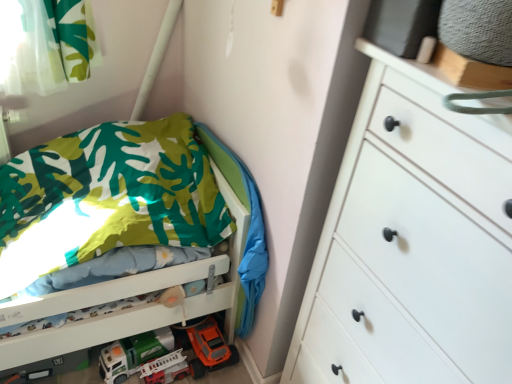
Question: Is green fabric blanket at lower left thinner than matte white plastic fire truck at lower left, placed as the 2th toy car when sorted from left to right?

Choices:
 (A) no
 (B) yes

Answer: (B)

Question: Is green fabric blanket at lower left behind matte white plastic fire truck at lower left, marked as the first toy car in a right-to-left arrangement?

Choices:
 (A) no
 (B) yes

Answer: (A)

Question: Can you confirm if green fabric blanket at lower left is shorter than matte white plastic fire truck at lower left, placed as the 2th toy car when sorted from left to right?

Choices:
 (A) yes
 (B) no

Answer: (B)

Question: Is green fabric blanket at lower left touching matte white plastic fire truck at lower left, placed as the 2th toy car when sorted from left to right?

Choices:
 (A) yes
 (B) no

Answer: (B)

Question: Considering the relative sizes of green fabric blanket at lower left and matte white plastic fire truck at lower left, marked as the first toy car in a right-to-left arrangement, in the image provided, is green fabric blanket at lower left taller than matte white plastic fire truck at lower left, marked as the first toy car in a right-to-left arrangement,?

Choices:
 (A) yes
 (B) no

Answer: (A)

Question: From their relative heights in the image, would you say printed fabric bed at left is taller or shorter than matte white plastic fire truck at lower left, placed as the 2th toy car when sorted from left to right?

Choices:
 (A) short
 (B) tall

Answer: (B)

Question: Based on their sizes in the image, would you say printed fabric bed at left is bigger or smaller than matte white plastic fire truck at lower left, marked as the first toy car in a right-to-left arrangement?

Choices:
 (A) small
 (B) big

Answer: (B)

Question: From the image's perspective, is printed fabric bed at left located above or below matte white plastic fire truck at lower left, marked as the first toy car in a right-to-left arrangement?

Choices:
 (A) above
 (B) below

Answer: (A)

Question: In the image, is printed fabric bed at left positioned in front of or behind matte white plastic fire truck at lower left, placed as the 2th toy car when sorted from left to right?

Choices:
 (A) behind
 (B) front

Answer: (B)

Question: From their relative heights in the image, would you say printed fabric bed at left is taller or shorter than white matte chest of drawers at right?

Choices:
 (A) short
 (B) tall

Answer: (A)

Question: Looking at the image, does printed fabric bed at left seem bigger or smaller compared to white matte chest of drawers at right?

Choices:
 (A) small
 (B) big

Answer: (B)

Question: Does point (175, 201) appear closer or farther from the camera than point (360, 218)?

Choices:
 (A) farther
 (B) closer

Answer: (A)

Question: Considering their positions, is printed fabric bed at left located in front of or behind white matte chest of drawers at right?

Choices:
 (A) behind
 (B) front

Answer: (A)

Question: Would you say matte white plastic fire truck at lower left, placed as the 2th toy car when sorted from left to right, is to the left or to the right of white plastic toy car at lower center, marked as the second toy car in a right-to-left arrangement, in the picture?

Choices:
 (A) left
 (B) right

Answer: (B)

Question: In terms of size, does matte white plastic fire truck at lower left, placed as the 2th toy car when sorted from left to right, appear bigger or smaller than white plastic toy car at lower center, marked as the second toy car in a right-to-left arrangement?

Choices:
 (A) small
 (B) big

Answer: (A)